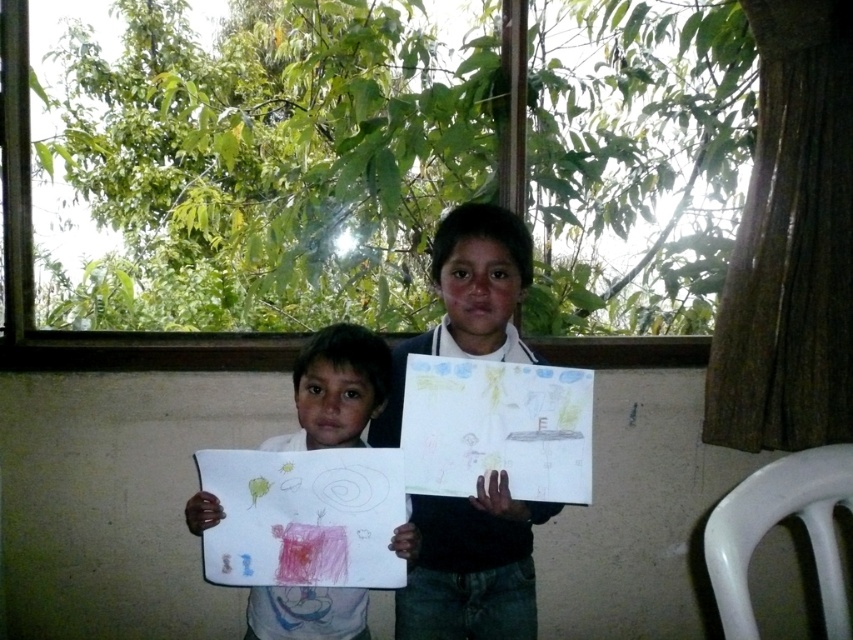
You are a photographer who wants to take a picture of the white paper at center and the smooth black shirt at center. Based on their positions, which object should you focus on first if you want to capture both in the same frame without moving the camera?

The smooth black shirt at center is to the right of the white paper at center, so you should focus on the white paper at center first to ensure both are in the frame.

You are a photographer trying to capture both the smooth black shirt at center and the white paper at center in a single frame. Based on their sizes, which object should you focus on first to ensure both fit properly in the photo?

The smooth black shirt at center is larger than the white paper at center, so you should focus on framing the smooth black shirt at center first to ensure it fits, then adjust to include the smaller white paper at center.